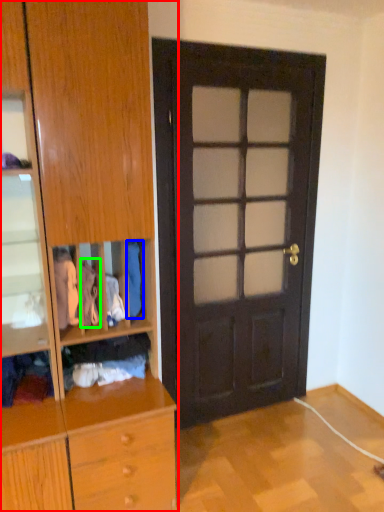
Question: Based on their relative distances, which object is farther from cabinetry (highlighted by a red box)? Choose from clothing (highlighted by a blue box) and clothing (highlighted by a green box).

Choices:
 (A) clothing
 (B) clothing

Answer: (A)